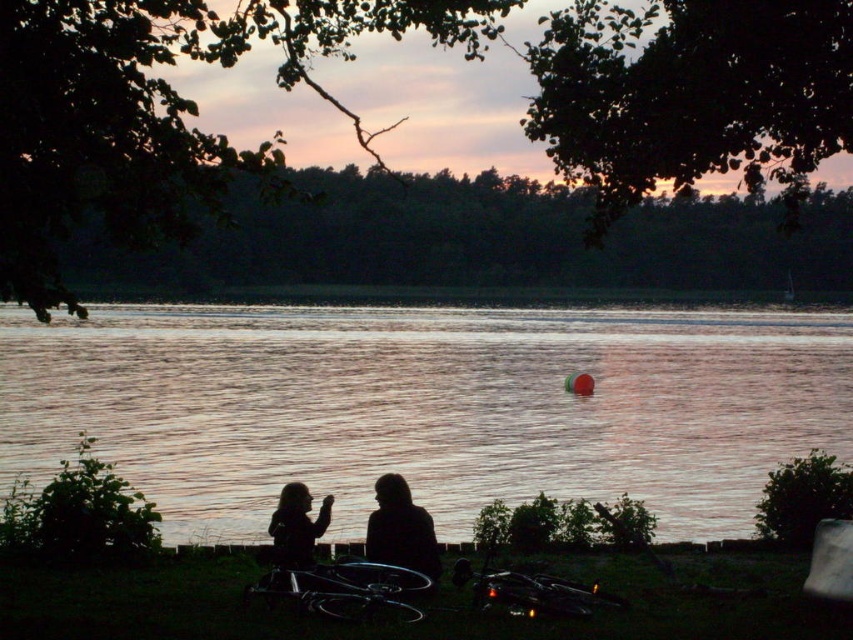
You are a photographer wanting to capture both the silhouette figure at center and the silhouette fabric person at center in your shot. Since you want both subjects to be clearly visible, which one might you need to adjust the focus on to ensure it doesn not get lost in the background?

The silhouette fabric person at center is further away, so adjusting focus on it would help ensure it remains visible against the background.

You are standing at the center of the image and want to walk towards the silhouette fabric couple at lower center. Which direction should you go?

The silhouette fabric couple at lower center is located at point 0.828 on the x axis and 0.471 on the y axis, so you should walk towards the lower center direction to reach them.